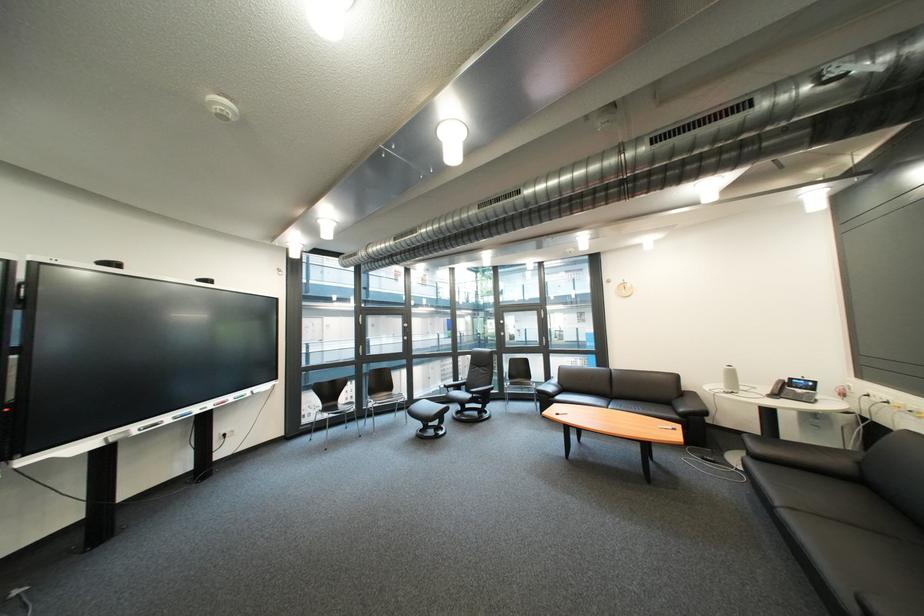
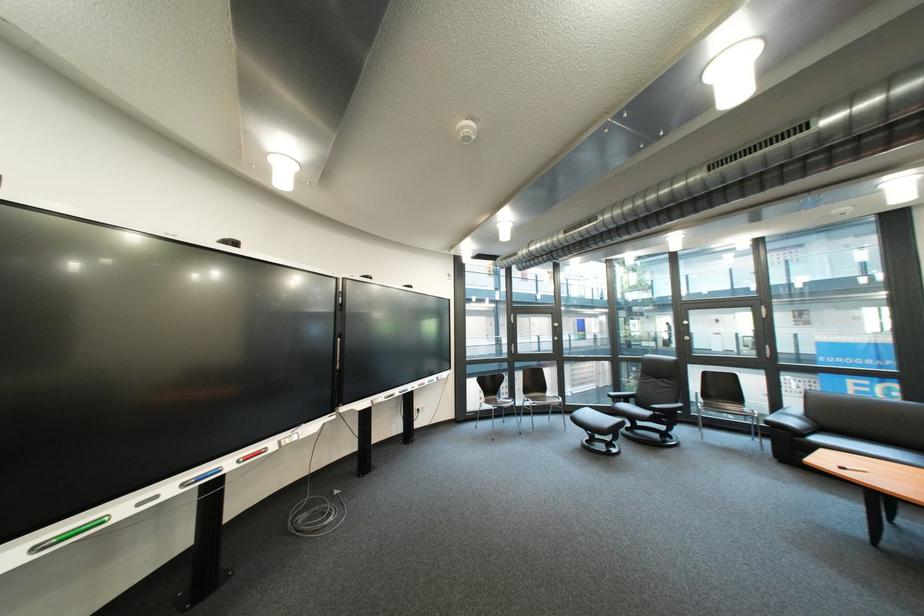
In the second image, find the point that corresponds to pixel 482 398 in the first image.

(661, 415)